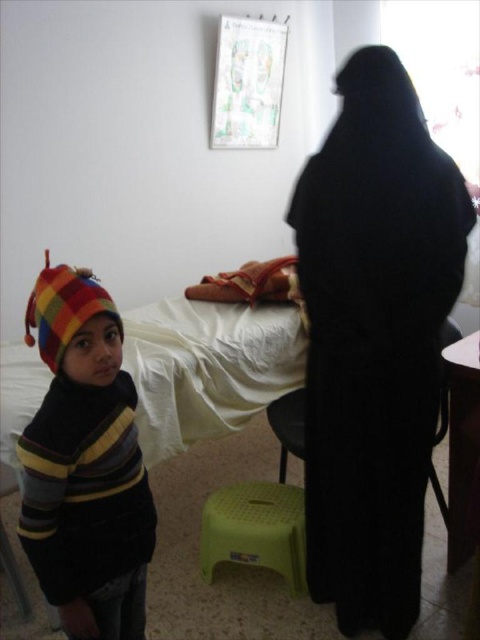
Question: Where is white soft bed at center located in relation to wooden table at lower right in the image?

Choices:
 (A) above
 (B) below

Answer: (A)

Question: Does white soft bed at center have a larger size compared to green plastic stool at lower center?

Choices:
 (A) yes
 (B) no

Answer: (A)

Question: Which point is closer to the camera?

Choices:
 (A) (300, 413)
 (B) (252, 518)
 (C) (249, 332)
 (D) (451, 403)

Answer: (D)

Question: Does black matte dress at right have a smaller size compared to striped woolen sweater at left?

Choices:
 (A) no
 (B) yes

Answer: (A)

Question: Which point is farther to the camera?

Choices:
 (A) striped woolen sweater at left
 (B) black plastic chair at lower center
 (C) white soft bed at center
 (D) green plastic stool at lower center

Answer: (D)

Question: Among these points, which one is farthest from the camera?

Choices:
 (A) (123, 513)
 (B) (454, 380)
 (C) (231, 541)

Answer: (C)